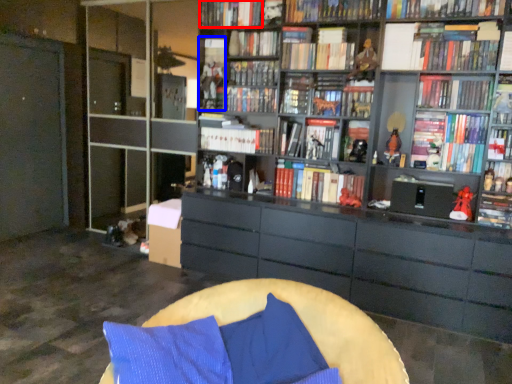
Question: Which object appears farthest to the camera in this image, book (highlighted by a red box) or book (highlighted by a blue box)?

Choices:
 (A) book
 (B) book

Answer: (B)